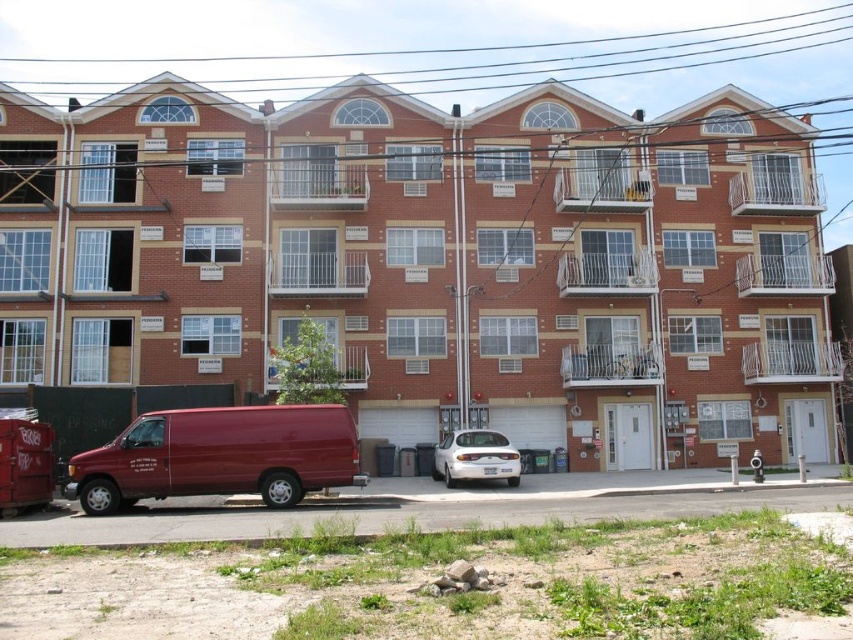
Measure the distance from black wire at upper center to matte red van at lower left.

black wire at upper center and matte red van at lower left are 71.69 meters apart.

Does point (287, 97) come in front of point (339, 477)?

No.

Image resolution: width=853 pixels, height=640 pixels. Find the location of `black wire at upper center`. black wire at upper center is located at coordinates (432, 45).

Does black wire at upper center appear over white glossy sedan at center?

Correct, black wire at upper center is located above white glossy sedan at center.

Who is positioned more to the left, black wire at upper center or white glossy sedan at center?

black wire at upper center is more to the left.

What are the coordinates of `black wire at upper center` in the screenshot? It's located at (432, 45).

Does matte red van at lower left come in front of white glossy sedan at center?

That is True.

Is point (177, 436) farther from camera compared to point (474, 472)?

That is False.

What do you see at coordinates (219, 456) in the screenshot? I see `matte red van at lower left` at bounding box center [219, 456].

Locate an element on the screen. matte red van at lower left is located at coordinates (219, 456).